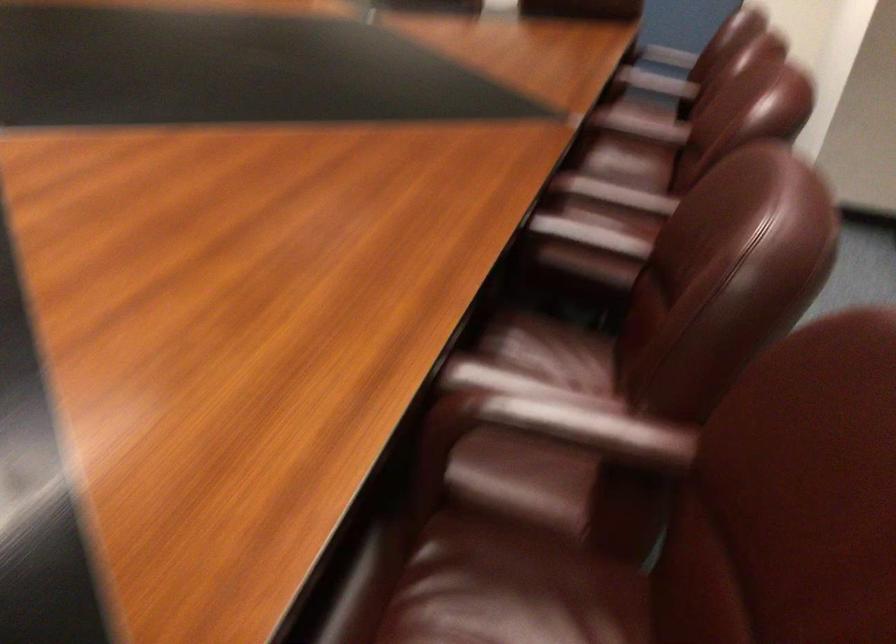
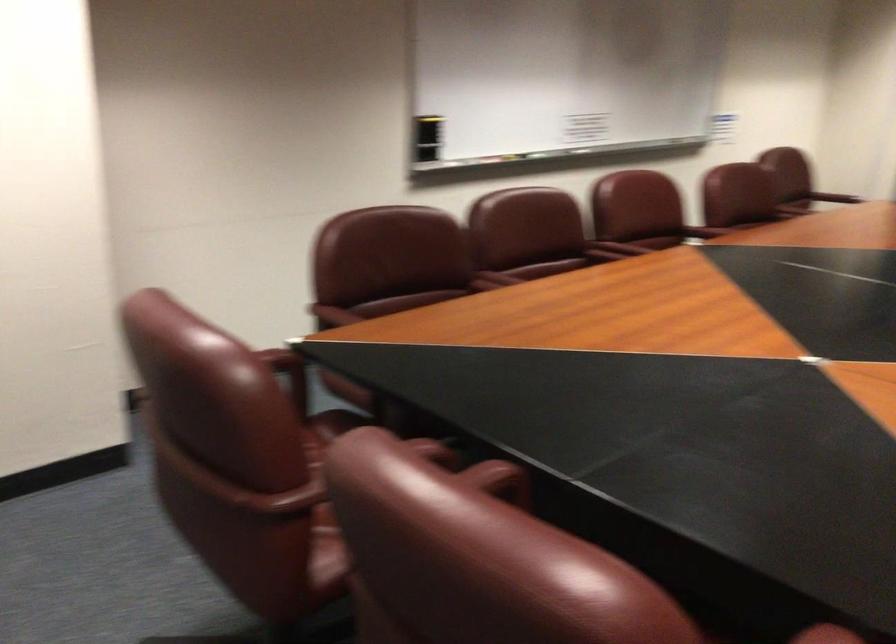
In the second image, find the point that corresponds to the point at 615,198 in the first image.

(703, 232)